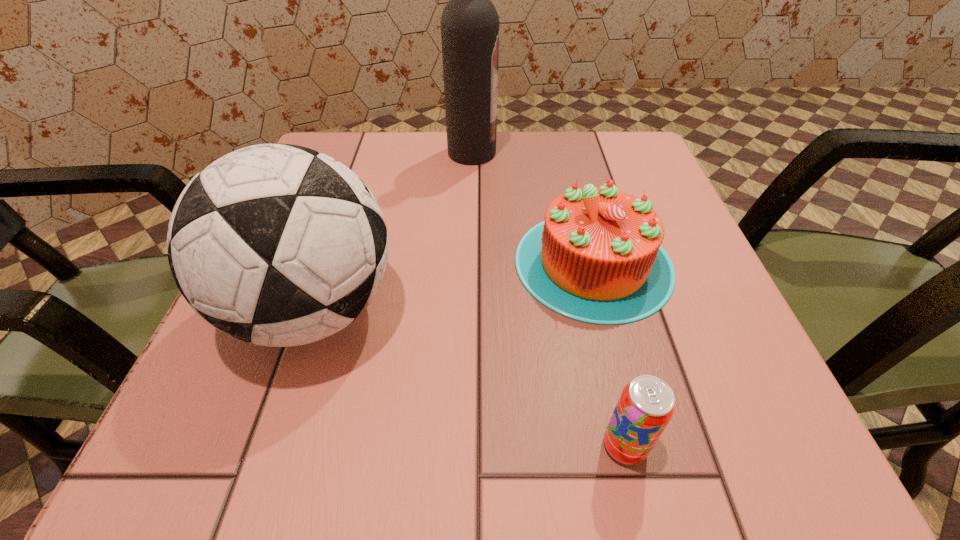
In the image, there is a desktop. At what (x,y) coordinates should I click in order to perform the action: click on vacant space at the near left corner. Please return your answer as a coordinate pair (x, y). The image size is (960, 540). Looking at the image, I should click on (212, 445).

Locate an element on the screen. free space at the far right corner of the desktop is located at coordinates (588, 165).

At what (x,y) coordinates should I click in order to perform the action: click on vacant space in between the farthest object and the soccer ball. Please return your answer as a coordinate pair (x, y). Image resolution: width=960 pixels, height=540 pixels. Looking at the image, I should click on (393, 232).

Locate an element on the screen. This screenshot has width=960, height=540. empty space that is in between the nearest object and the second tallest object is located at coordinates (469, 378).

Locate an element on the screen. The width and height of the screenshot is (960, 540). vacant area that lies between the leftmost object and the shortest object is located at coordinates (469, 378).

Image resolution: width=960 pixels, height=540 pixels. In order to click on vacant space that's between the farthest object and the cake in this screenshot , I will do `click(533, 208)`.

Where is `vacant area that lies between the third shortest object and the third object from right to left`? The height and width of the screenshot is (540, 960). vacant area that lies between the third shortest object and the third object from right to left is located at coordinates (393, 232).

The height and width of the screenshot is (540, 960). What are the coordinates of `empty location between the farthest object and the soccer ball` in the screenshot? It's located at (393, 232).

Where is `free point between the cake and the leftmost object`? This screenshot has width=960, height=540. free point between the cake and the leftmost object is located at coordinates (453, 287).

Where is `object that is the third closest to the second shortest object`? The width and height of the screenshot is (960, 540). object that is the third closest to the second shortest object is located at coordinates (276, 244).